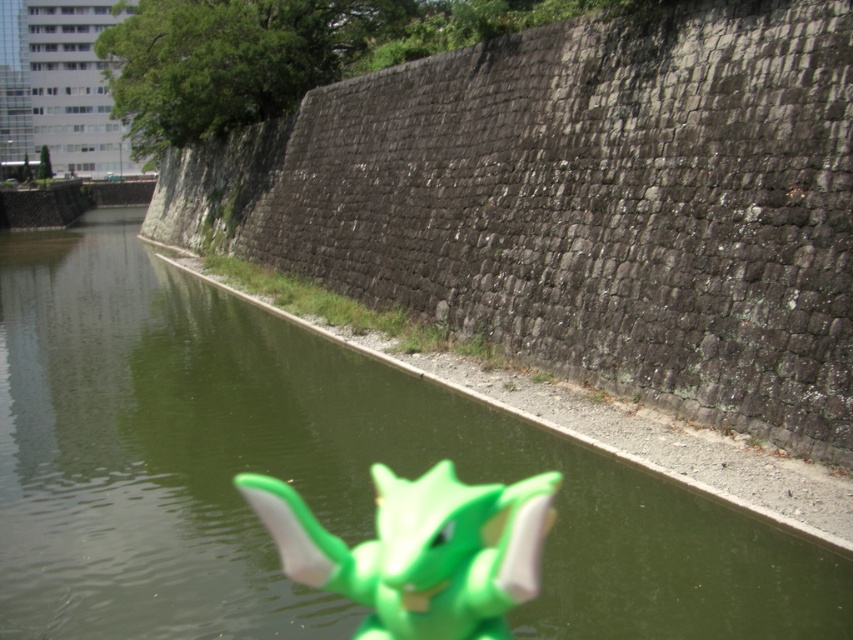
Does green plastic river at center have a lesser height compared to green matte toy at center?

No, green plastic river at center is not shorter than green matte toy at center.

Measure the distance from green plastic river at center to green matte toy at center.

green plastic river at center is 17.21 meters from green matte toy at center.

Describe the element at coordinates (306, 474) in the screenshot. I see `green plastic river at center` at that location.

The image size is (853, 640). I want to click on green plastic river at center, so [x=306, y=474].